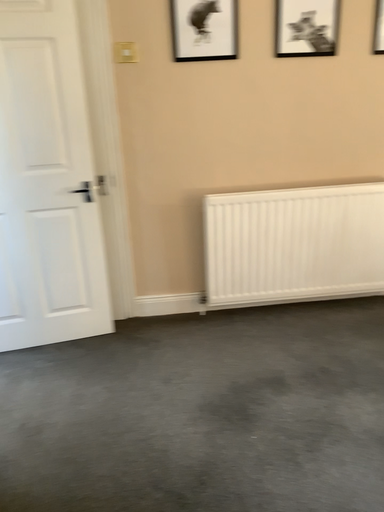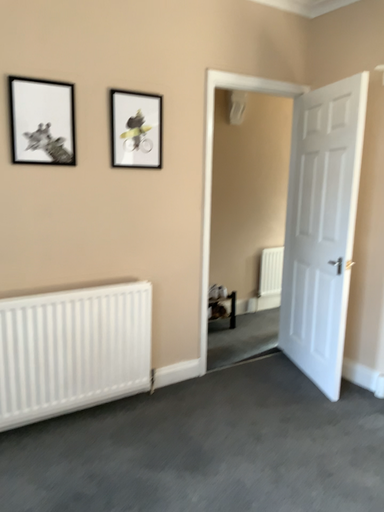
Question: How did the camera likely rotate when shooting the video?

Choices:
 (A) rotated left
 (B) rotated right

Answer: (B)